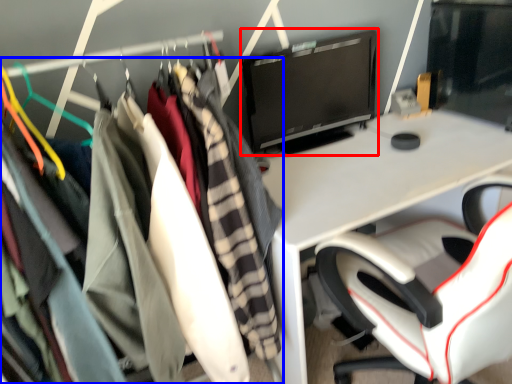
Question: Which object appears farthest to the camera in this image, computer monitor (highlighted by a red box) or clothing (highlighted by a blue box)?

Choices:
 (A) computer monitor
 (B) clothing

Answer: (A)